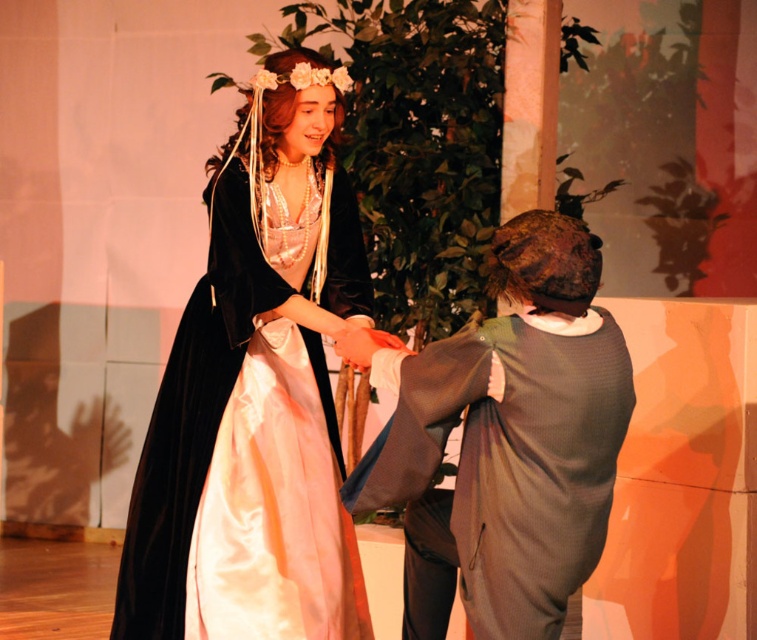
Looking at this image, you are a stagehand preparing to move the velvet black dress at center and the dark gray wool coat at center to the left side of the stage. Which clothing item should you move first to ensure they are arranged in the correct order as seen in the scene?

The velvet black dress at center should be moved first to the left side of the dark gray wool coat at center, as it is already positioned on the left side of it in the original scene.